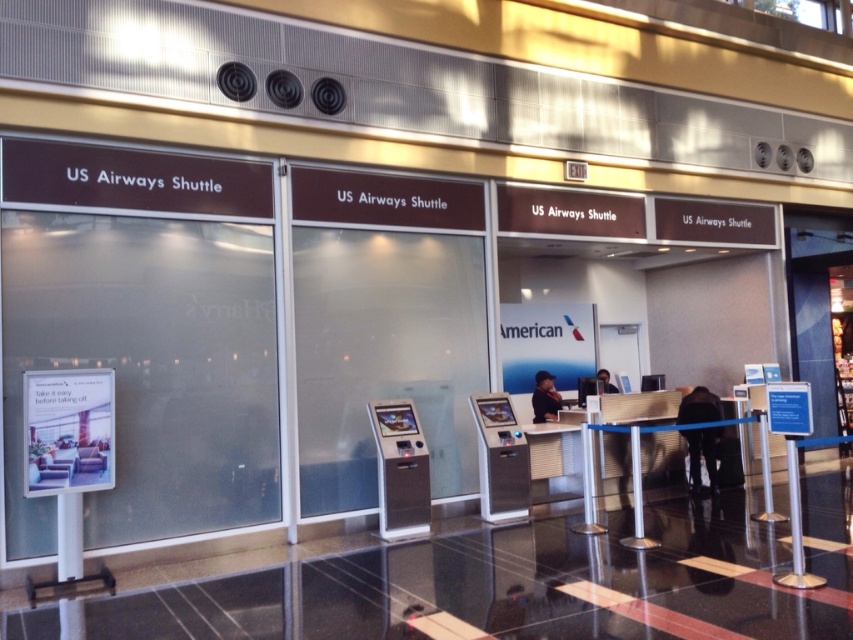
Identify the location of dark blue shirt at center. (544, 397).

Looking at this image, does dark blue shirt at center have a larger size compared to matte black laptop at center?

Indeed, dark blue shirt at center has a larger size compared to matte black laptop at center.

Image resolution: width=853 pixels, height=640 pixels. What are the coordinates of `dark blue shirt at center` in the screenshot? It's located at (544, 397).

Can you confirm if dark fabric jacket at center is smaller than matte black laptop at center?

No.

Between dark fabric jacket at center and matte black laptop at center, which one has more height?

dark fabric jacket at center

Which is behind, point (689, 413) or point (608, 381)?

The point (608, 381) is behind.

Locate an element on the screen. The height and width of the screenshot is (640, 853). dark fabric jacket at center is located at coordinates (701, 456).

Can you confirm if dark fabric jacket at center is positioned to the left of dark blue shirt at center?

In fact, dark fabric jacket at center is to the right of dark blue shirt at center.

Does dark fabric jacket at center have a greater width compared to dark blue shirt at center?

Indeed, dark fabric jacket at center has a greater width compared to dark blue shirt at center.

Locate an element on the screen. This screenshot has width=853, height=640. dark fabric jacket at center is located at coordinates (701, 456).